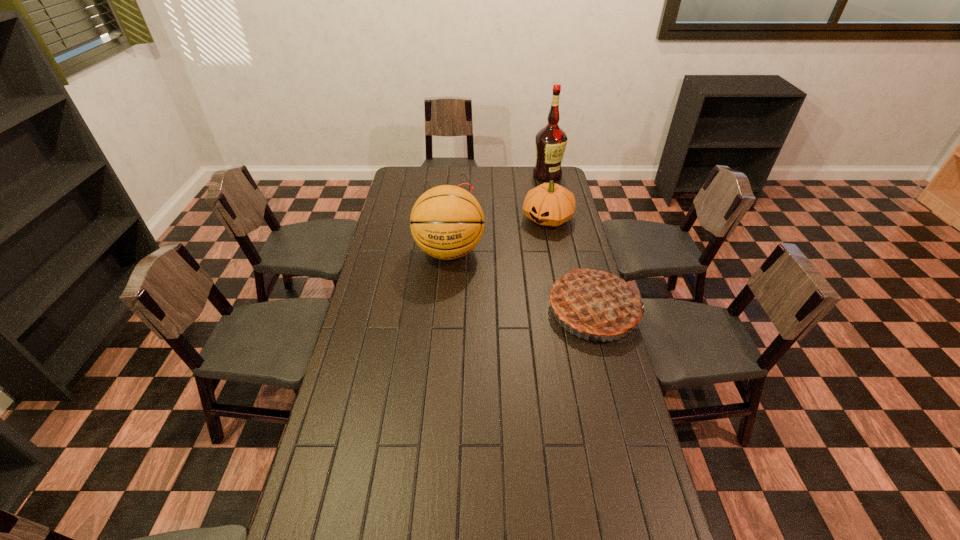
Locate an element on the screen. This screenshot has width=960, height=540. free space on the desktop that is between the basketball and the third shortest object and is positioned on the label of the alcohol is located at coordinates (522, 281).

At what (x,y) coordinates should I click in order to perform the action: click on free spot on the desktop that is between the basketball and the pie and is positioned on the side of the second shortest object with the carved face. Please return your answer as a coordinate pair (x, y). Looking at the image, I should click on (503, 273).

This screenshot has height=540, width=960. I want to click on free space on the desktop that is between the basketball and the third shortest object and is positioned on the front-facing side of the shortest object, so click(502, 273).